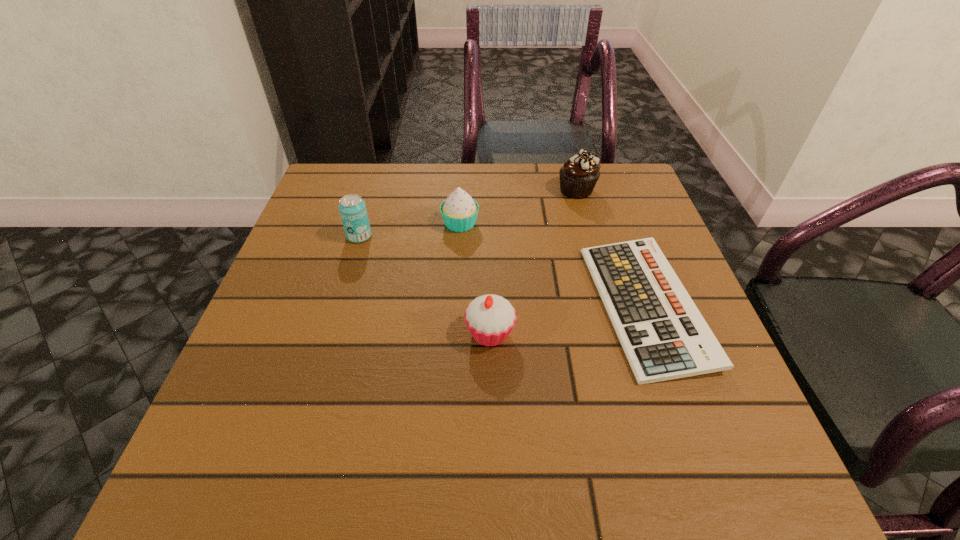
This screenshot has width=960, height=540. Identify the location of the rightmost cupcake. (578, 176).

Identify the location of the farthest cupcake. (578, 176).

The height and width of the screenshot is (540, 960). Find the location of `the leftmost object`. the leftmost object is located at coordinates (352, 208).

The width and height of the screenshot is (960, 540). What are the coordinates of `the second farthest cupcake` in the screenshot? It's located at (459, 211).

This screenshot has width=960, height=540. Find the location of `the nearest cupcake`. the nearest cupcake is located at coordinates (490, 318).

The image size is (960, 540). I want to click on computer keyboard, so click(664, 336).

Find the location of `free space located 0.080m on the right of the farthest object`. free space located 0.080m on the right of the farthest object is located at coordinates (627, 190).

Where is `vacant space located on the left of the beer can`? vacant space located on the left of the beer can is located at coordinates (303, 236).

The width and height of the screenshot is (960, 540). I want to click on free space located 0.130m on the right of the second farthest cupcake, so click(x=534, y=223).

Locate an element on the screen. vacant space located 0.360m on the back of the nearest cupcake is located at coordinates (488, 204).